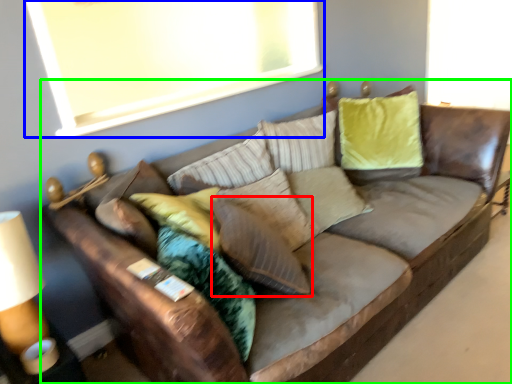
Question: Which object is the closest to the pillow (highlighted by a red box)? Choose among these: window screen (highlighted by a blue box) or studio couch (highlighted by a green box).

Choices:
 (A) window screen
 (B) studio couch

Answer: (B)